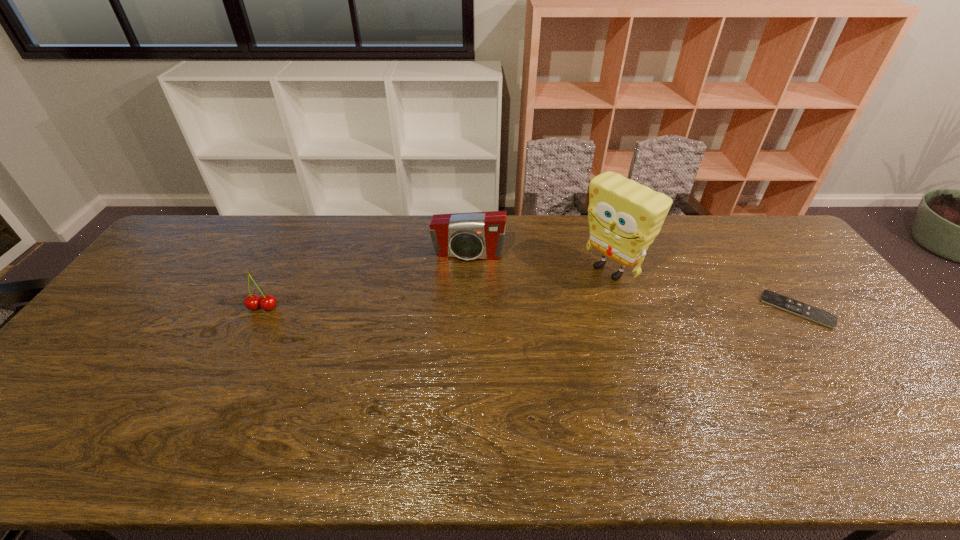
At what (x,y) coordinates should I click in order to perform the action: click on the leftmost object. Please return your answer as a coordinate pair (x, y). Looking at the image, I should click on (268, 302).

Find the location of a particular element. The image size is (960, 540). cherry is located at coordinates (268, 302).

At what (x,y) coordinates should I click in order to perform the action: click on the shortest object. Please return your answer as a coordinate pair (x, y). Looking at the image, I should click on (822, 317).

Locate an element on the screen. the rightmost object is located at coordinates (822, 317).

This screenshot has width=960, height=540. Identify the location of the third object from right to left. (478, 235).

Identify the location of the third shortest object. The height and width of the screenshot is (540, 960). (478, 235).

This screenshot has height=540, width=960. What are the coordinates of `the tallest object` in the screenshot? It's located at point(624,217).

Locate an element on the screen. Image resolution: width=960 pixels, height=540 pixels. the third object from left to right is located at coordinates (624, 217).

The height and width of the screenshot is (540, 960). In order to click on free space located 0.230m with the stems of the leftmost object pointing upwards in this screenshot , I will do [226, 381].

What are the coordinates of `vacant space located 0.380m on the left of the remote control` in the screenshot? It's located at (635, 309).